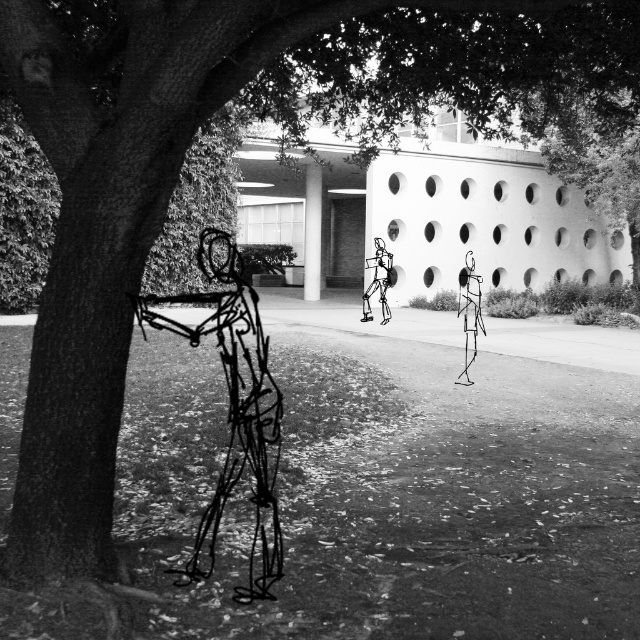
Question: Is wireframe figure at left to the left of wireframe figure at center from the viewer's perspective?

Choices:
 (A) no
 (B) yes

Answer: (B)

Question: Which point is farther to the camera?

Choices:
 (A) (246, 356)
 (B) (385, 256)

Answer: (B)

Question: Is wireframe figure at left positioned behind wireframe figure at center?

Choices:
 (A) no
 (B) yes

Answer: (A)

Question: Does wireframe figure at left have a smaller size compared to wireframe figure at center?

Choices:
 (A) yes
 (B) no

Answer: (B)

Question: Among these points, which one is farthest from the camera?

Choices:
 (A) (257, 426)
 (B) (369, 296)

Answer: (B)